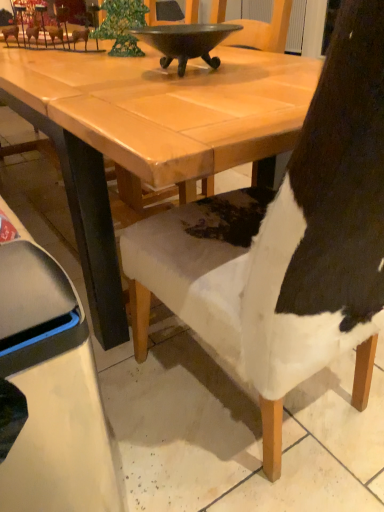
Question: Considering the relative sizes of shiny dark metal bowl at upper center and white fabric chair at lower right, the 1th chair when ordered from left to right, in the image provided, is shiny dark metal bowl at upper center shorter than white fabric chair at lower right, the 1th chair when ordered from left to right,?

Choices:
 (A) yes
 (B) no

Answer: (A)

Question: From a real-world perspective, is shiny dark metal bowl at upper center positioned over white fabric chair at lower right, acting as the 2th chair starting from the right, based on gravity?

Choices:
 (A) yes
 (B) no

Answer: (A)

Question: Is shiny dark metal bowl at upper center oriented away from white fabric chair at lower right, acting as the 2th chair starting from the right?

Choices:
 (A) no
 (B) yes

Answer: (A)

Question: Is shiny dark metal bowl at upper center taller than white fabric chair at lower right, acting as the 2th chair starting from the right?

Choices:
 (A) no
 (B) yes

Answer: (A)

Question: From a real-world perspective, is shiny dark metal bowl at upper center physically below white fabric chair at lower right, acting as the 2th chair starting from the right?

Choices:
 (A) no
 (B) yes

Answer: (A)

Question: Is shiny dark metal bowl at upper center far from white fabric chair at lower right, acting as the 2th chair starting from the right?

Choices:
 (A) yes
 (B) no

Answer: (B)

Question: Is white fur chair at center, marked as the second chair in a left-to-right arrangement, smaller than white fabric chair at lower right, acting as the 2th chair starting from the right?

Choices:
 (A) yes
 (B) no

Answer: (B)

Question: Is white fur chair at center, marked as the second chair in a left-to-right arrangement, oriented away from white fabric chair at lower right, the 1th chair when ordered from left to right?

Choices:
 (A) no
 (B) yes

Answer: (A)

Question: Can you confirm if white fur chair at center, marked as the second chair in a left-to-right arrangement, is bigger than white fabric chair at lower right, acting as the 2th chair starting from the right?

Choices:
 (A) yes
 (B) no

Answer: (A)

Question: From the image's perspective, does white fur chair at center, marked as the second chair in a left-to-right arrangement, appear lower than white fabric chair at lower right, acting as the 2th chair starting from the right?

Choices:
 (A) yes
 (B) no

Answer: (B)

Question: Is white fur chair at center, marked as the second chair in a left-to-right arrangement, to the right of white fabric chair at lower right, the 1th chair when ordered from left to right, from the viewer's perspective?

Choices:
 (A) no
 (B) yes

Answer: (B)

Question: Is white fur chair at center, marked as the second chair in a left-to-right arrangement, outside white fabric chair at lower right, the 1th chair when ordered from left to right?

Choices:
 (A) yes
 (B) no

Answer: (A)

Question: Is shiny dark metal bowl at upper center not within white fur chair at center, arranged as the 1th chair when viewed from the right?

Choices:
 (A) no
 (B) yes

Answer: (B)